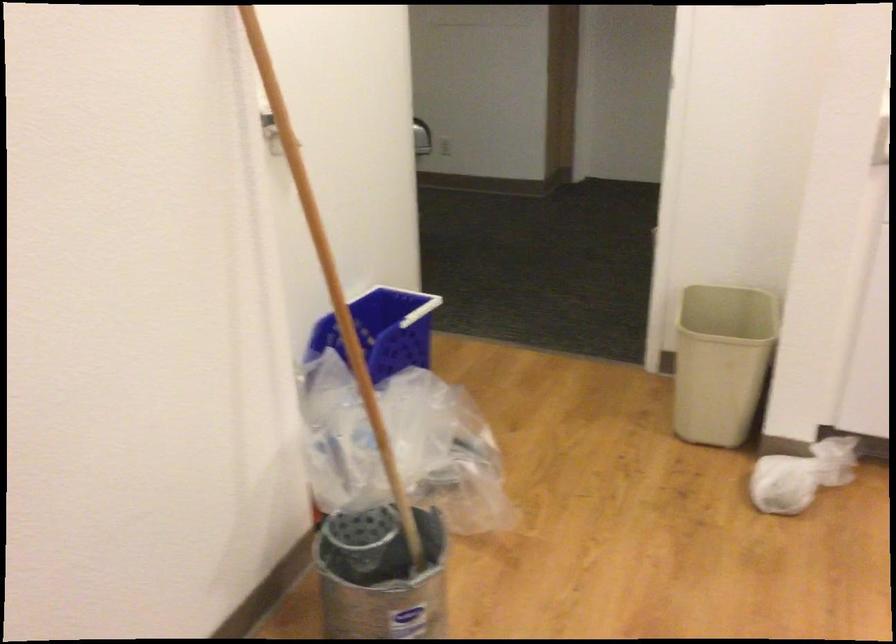
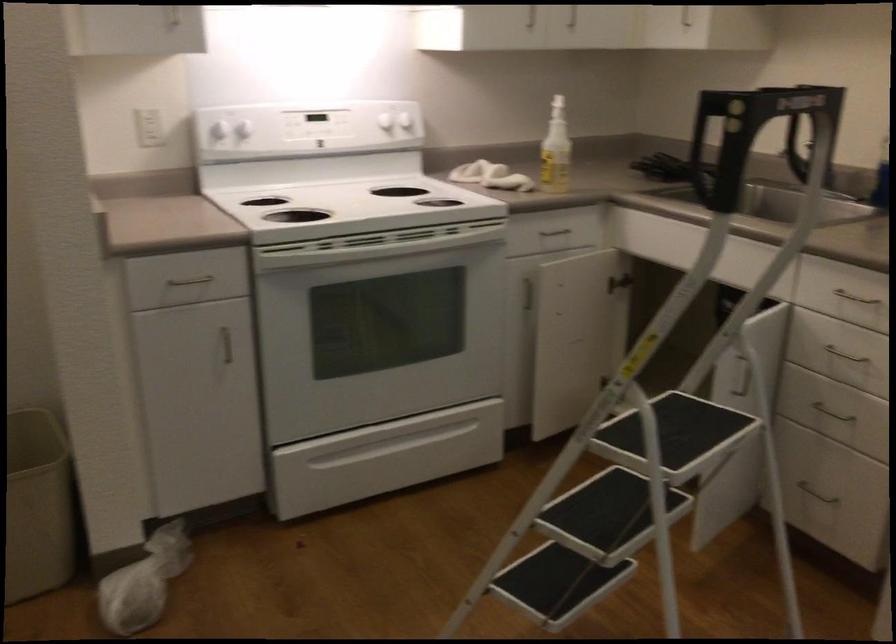
Question: The camera is either moving clockwise (left) or counter-clockwise (right) around the object. The first image is from the beginning of the video and the second image is from the end. Is the camera moving left or right when shooting the video?

Choices:
 (A) Left
 (B) Right

Answer: (A)